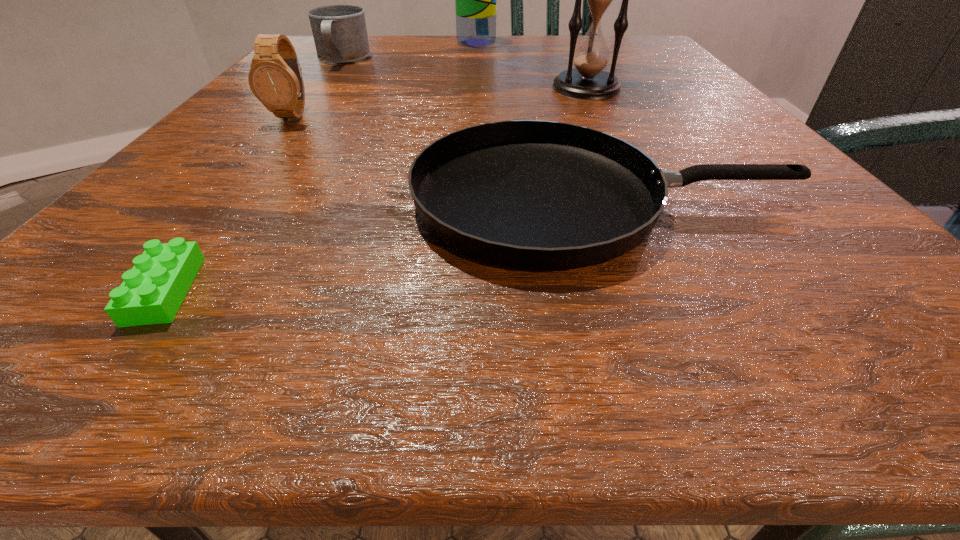
This screenshot has height=540, width=960. Identify the location of vacant area situated 0.200m on the face of the fourth farthest object. (228, 196).

I want to click on vacant region located on the side of the fourth tallest object with the handle, so click(273, 151).

Identify the location of free space located 0.130m on the back of the Lego. The height and width of the screenshot is (540, 960). (242, 190).

The image size is (960, 540). What are the coordinates of `water bottle present at the far edge` in the screenshot? It's located at (476, 0).

In order to click on mug situated at the far edge in this screenshot , I will do `click(339, 31)`.

The height and width of the screenshot is (540, 960). What are the coordinates of `object at the near edge` in the screenshot? It's located at (152, 292).

Identify the location of watch located in the left edge section of the desktop. This screenshot has height=540, width=960. (275, 78).

I want to click on mug located at the left edge, so click(x=339, y=31).

The width and height of the screenshot is (960, 540). Identify the location of Lego that is at the left edge. (152, 292).

I want to click on hourglass at the right edge, so click(x=588, y=81).